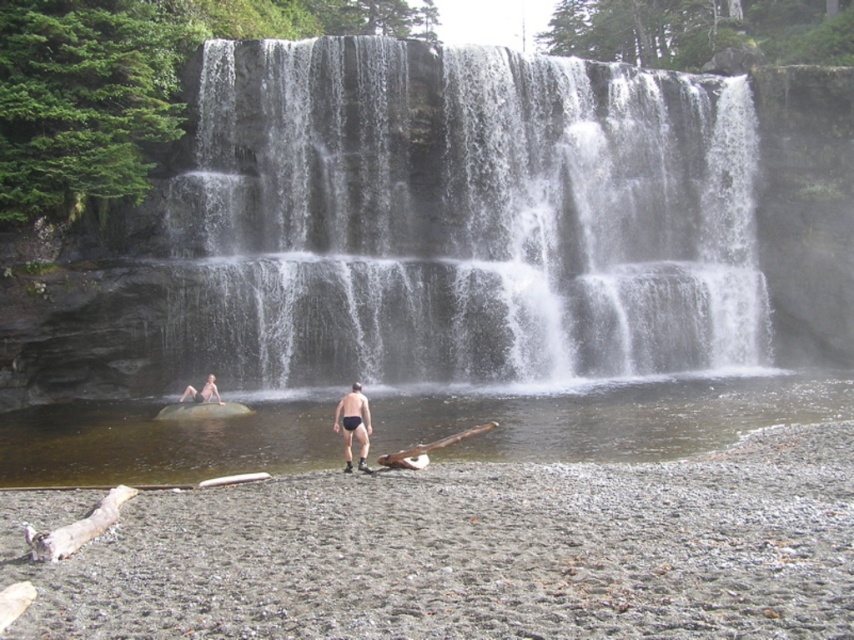
You are standing at the edge of the waterfall and want to reach the point marked at coordinates point (461,221). According to the scene description, where exactly is this point located?

The point (461,221) is on the white textured water at center.

You are planning to take a photo of the waterfall and want to capture both the white textured water at center and the clear water at lower center in the same frame. Based on their positions, which one should you focus on first to ensure both are visible?

Since the white textured water at center is located above the clear water at lower center, you should focus on the white textured water at center first to ensure both are visible in the frame.

You are standing at the point marked by coordinates point (349, 419) in the image. You want to take a photo of the waterfall from this position. However, you need to ensure that your camera is at least 15 meters away from the edge of the pool to avoid slipping into the water. Is your current position safe?

The distance between you and the viewer is 17.60 meters, so yes, your current position at point (349, 419) is safe as it meets the minimum distance requirement of 15 meters.